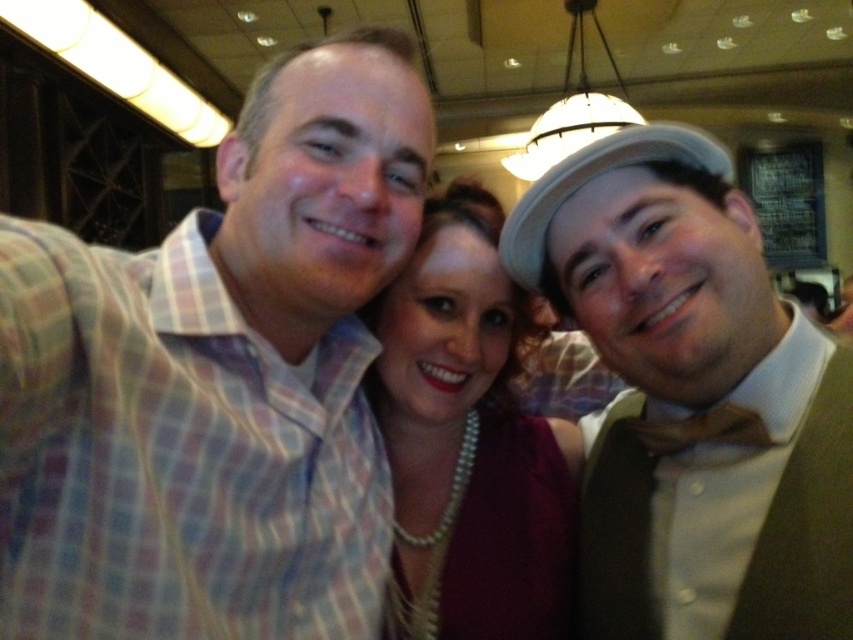
Does matte brown bow tie at center have a lesser width compared to pearl necklace at center?

In fact, matte brown bow tie at center might be wider than pearl necklace at center.

What do you see at coordinates (693, 396) in the screenshot? The height and width of the screenshot is (640, 853). I see `matte brown bow tie at center` at bounding box center [693, 396].

Where is `matte brown bow tie at center`? This screenshot has height=640, width=853. matte brown bow tie at center is located at coordinates (693, 396).